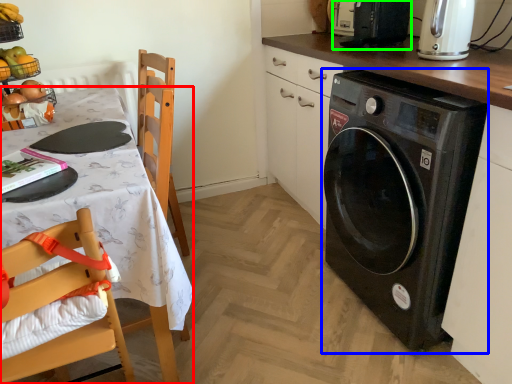
Question: Considering the real-world distances, which object is farthest from desk (highlighted by a red box)? washing machine (highlighted by a blue box) or appliance (highlighted by a green box)?

Choices:
 (A) washing machine
 (B) appliance

Answer: (B)